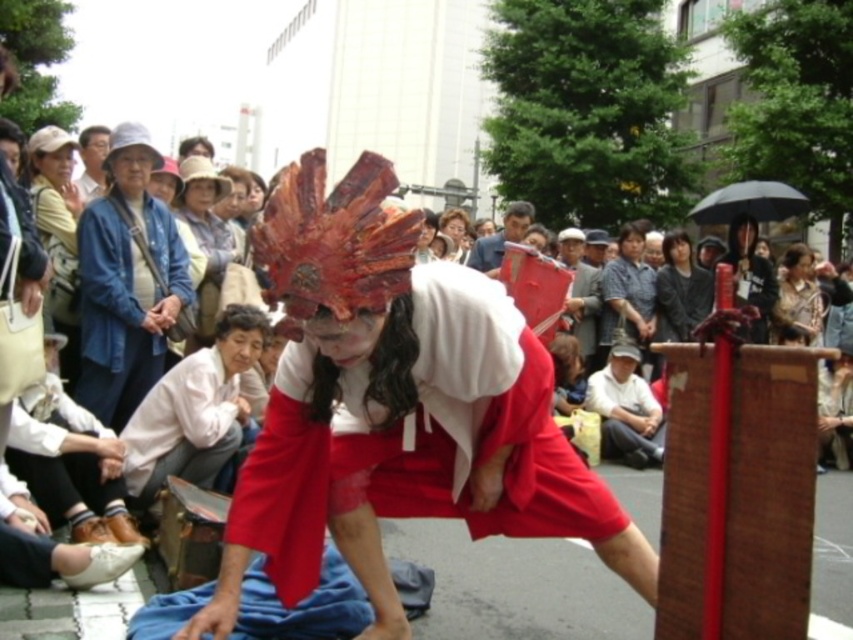
Question: Is brown textured jacket at upper center thinner than matte brown wooden box at center?

Choices:
 (A) no
 (B) yes

Answer: (A)

Question: Estimate the real-world distances between objects in this image. Which object is farther from the matte red fabric costume at center?

Choices:
 (A) white cotton shirt at center
 (B) blue denim jacket at upper left
 (C) brown textured jacket at upper center
 (D) dark gray fabric at center

Answer: (C)

Question: Can you confirm if dark gray fabric at center is thinner than smooth beige hair at center?

Choices:
 (A) yes
 (B) no

Answer: (B)

Question: Which of the following is the farthest from the observer?

Choices:
 (A) (467, 264)
 (B) (631, 321)
 (C) (788, 256)

Answer: (C)

Question: Which object is the farthest from the blue denim jacket at upper left?

Choices:
 (A) dark gray fabric at center
 (B) matte brown wooden box at center

Answer: (A)

Question: Can you confirm if dark gray fabric at center is wider than smooth beige hair at center?

Choices:
 (A) no
 (B) yes

Answer: (B)